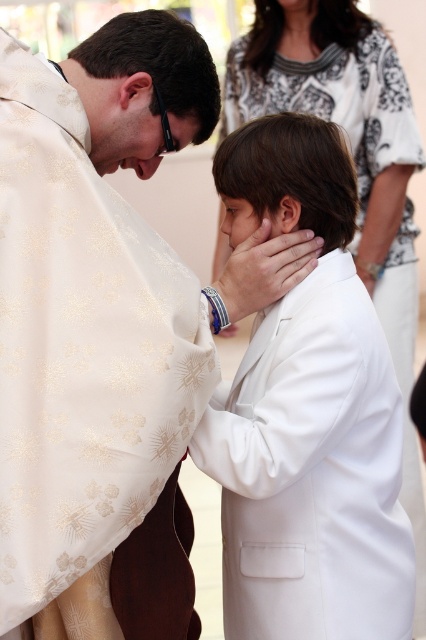
Does white matte hand at center have a lesser width compared to matte gold face at center?

Incorrect, white matte hand at center's width is not less than matte gold face at center's.

Can you confirm if white matte hand at center is wider than matte gold face at center?

Correct, the width of white matte hand at center exceeds that of matte gold face at center.

Find the location of `white matte hand at center`. white matte hand at center is located at coordinates 264,268.

Based on the photo, does white satin suit at center have a larger size compared to white matte hand at center?

Yes, white satin suit at center is bigger than white matte hand at center.

The width and height of the screenshot is (426, 640). What do you see at coordinates (308, 419) in the screenshot?
I see `white satin suit at center` at bounding box center [308, 419].

Image resolution: width=426 pixels, height=640 pixels. I want to click on white satin suit at center, so click(308, 419).

Can you confirm if white satin suit at center is positioned to the right of matte gold face at center?

Indeed, white satin suit at center is positioned on the right side of matte gold face at center.

Which is above, white satin suit at center or matte gold face at center?

matte gold face at center

The height and width of the screenshot is (640, 426). Identify the location of white satin suit at center. (308, 419).

You are a GUI agent. You are given a task and a screenshot of the screen. Output one action in this format:
    pyautogui.click(x=<x>, y=<y>)
    Task: Click on the white satin suit at center
    Image resolution: width=426 pixels, height=640 pixels.
    Given the screenshot: What is the action you would take?
    pyautogui.click(x=308, y=419)